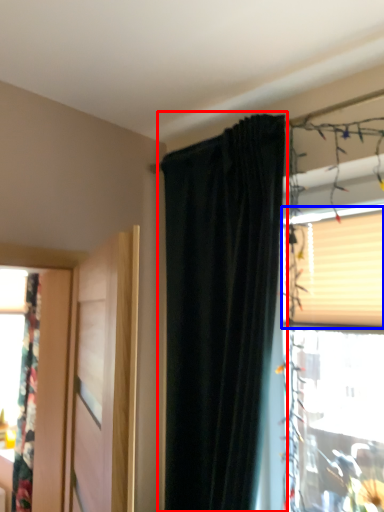
Question: Which of the following is the farthest to the observer, curtain (highlighted by a red box) or blind (highlighted by a blue box)?

Choices:
 (A) curtain
 (B) blind

Answer: (B)